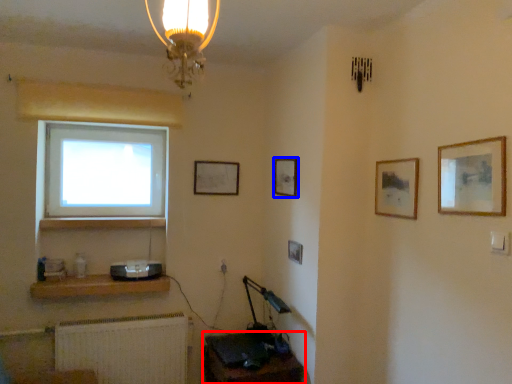
Question: Which object appears closest to the camera in this image, computer desk (highlighted by a red box) or picture frame (highlighted by a blue box)?

Choices:
 (A) computer desk
 (B) picture frame

Answer: (A)